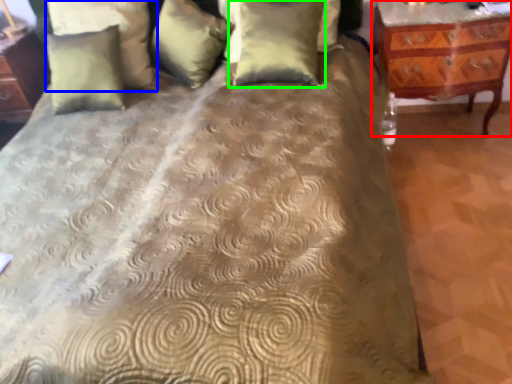
Question: Considering the real-world distances, which object is closest to nightstand (highlighted by a red box)? pillow (highlighted by a blue box) or pillow (highlighted by a green box).

Choices:
 (A) pillow
 (B) pillow

Answer: (B)